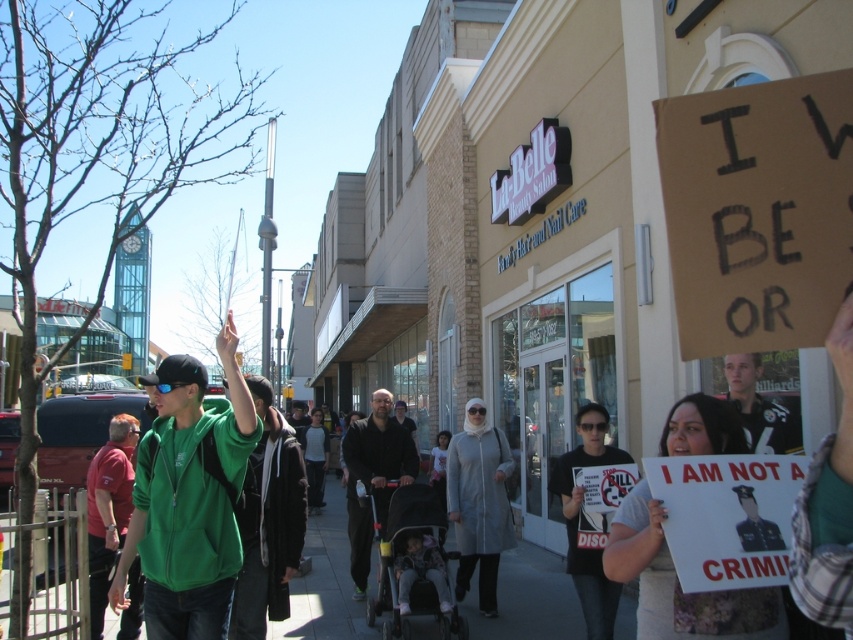
Question: From the image, what is the correct spatial relationship of green zip-up hoodie at center in relation to red shirt at left?

Choices:
 (A) above
 (B) below

Answer: (A)

Question: Is green zip-up hoodie at center further to the viewer compared to white leather jacket at center?

Choices:
 (A) yes
 (B) no

Answer: (B)

Question: Based on their relative distances, which object is nearer to the white leather jacket at center?

Choices:
 (A) red shirt at left
 (B) green zip-up hoodie at center

Answer: (B)

Question: Does green zip-up hoodie at center have a smaller size compared to dark gray fabric stroller at center?

Choices:
 (A) no
 (B) yes

Answer: (A)

Question: Which of the following is the farthest from the observer?

Choices:
 (A) (183, 596)
 (B) (138, 595)
 (C) (386, 404)

Answer: (C)

Question: Among these points, which one is farthest from the camera?

Choices:
 (A) click(111, 509)
 (B) click(148, 588)
 (C) click(750, 385)
 (D) click(369, 541)

Answer: (D)